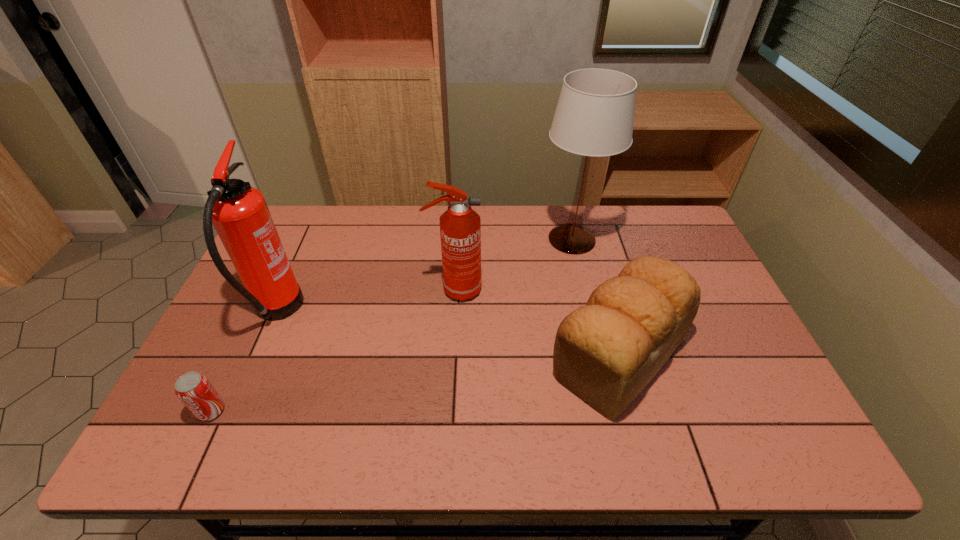
Identify the location of vacant area at the far edge. (537, 224).

The width and height of the screenshot is (960, 540). In the image, there is a desktop. What are the coordinates of `vacant region at the near edge` in the screenshot? It's located at (395, 436).

Where is `free space at the far left corner`? Image resolution: width=960 pixels, height=540 pixels. free space at the far left corner is located at coordinates click(290, 212).

At what (x,y) coordinates should I click in order to perform the action: click on free space at the far right corner of the desktop. Please return your answer as a coordinate pair (x, y). The width and height of the screenshot is (960, 540). Looking at the image, I should click on (681, 237).

Find the location of `vacant area that lies between the soda can and the third object from right to left`. vacant area that lies between the soda can and the third object from right to left is located at coordinates point(333,350).

Where is `free space between the third object from right to left and the shortest object`? The height and width of the screenshot is (540, 960). free space between the third object from right to left and the shortest object is located at coordinates (333, 350).

This screenshot has width=960, height=540. I want to click on vacant region between the left fire extinguisher and the farthest object, so click(x=424, y=276).

Where is `free space between the soda can and the third tallest object`? The height and width of the screenshot is (540, 960). free space between the soda can and the third tallest object is located at coordinates (333, 350).

This screenshot has width=960, height=540. What are the coordinates of `free area in between the soda can and the right fire extinguisher` in the screenshot? It's located at (333, 350).

Where is `vacant area that lies between the table lamp and the soda can`? This screenshot has width=960, height=540. vacant area that lies between the table lamp and the soda can is located at coordinates (392, 325).